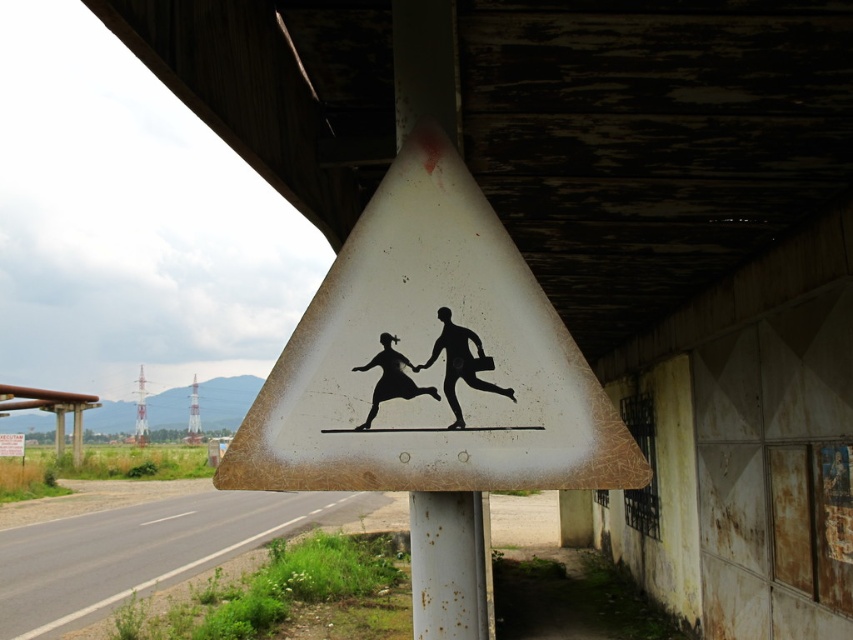
You are a delivery driver who needs to park your truck near the triangular road sign. Your truck requires a parking space of at least 20 feet in length. Based on the distance between the rusty metal pole at center and the black silhouette at center, can you safely park your truck here?

The distance between the rusty metal pole at center and the black silhouette at center is 18.97 feet, which is shorter than the required 20 feet. Therefore, you cannot safely park your truck here.